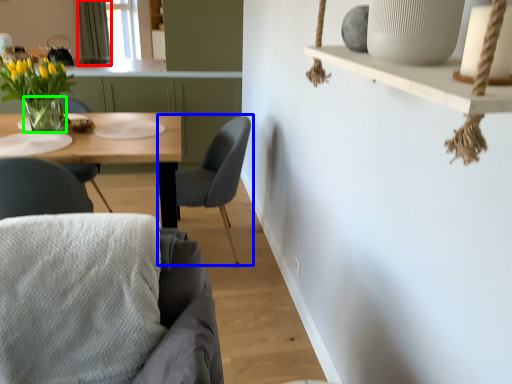
Question: Which object is the closest to the curtain (highlighted by a red box)? Choose among these: chair (highlighted by a blue box) or vase (highlighted by a green box).

Choices:
 (A) chair
 (B) vase

Answer: (B)